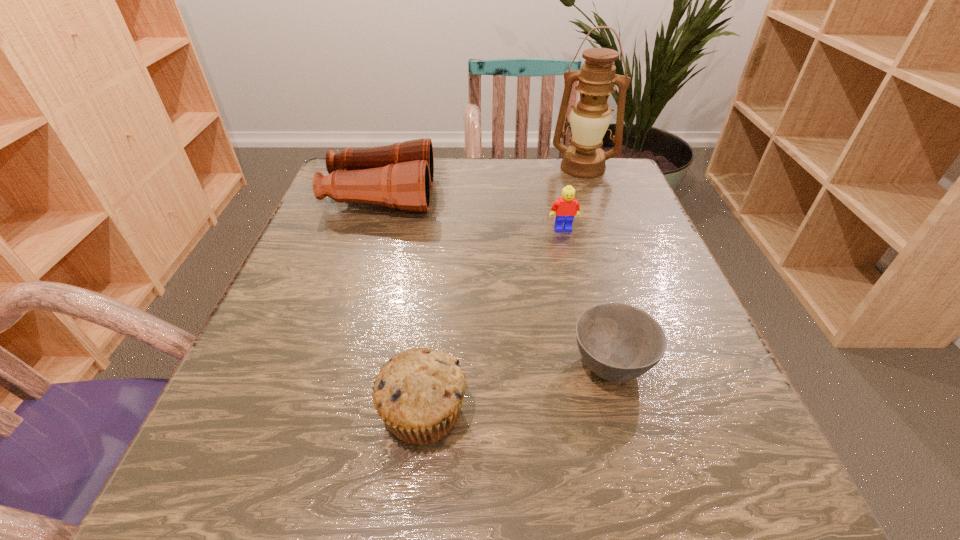
Identify the location of oil lamp located at the far edge. (589, 119).

Where is `binoculars located at the far edge`? The image size is (960, 540). binoculars located at the far edge is located at coordinates (400, 175).

Where is `object at the near edge`? object at the near edge is located at coordinates (418, 394).

Find the location of a particular element. The width and height of the screenshot is (960, 540). object situated at the left edge is located at coordinates (400, 175).

Find the location of `oil lamp at the right edge`. oil lamp at the right edge is located at coordinates (589, 119).

Image resolution: width=960 pixels, height=540 pixels. I want to click on Lego located at the right edge, so click(567, 207).

You are a GUI agent. You are given a task and a screenshot of the screen. Output one action in this format:
    pyautogui.click(x=<x>, y=<y>)
    Task: Click on the bowl that is at the right edge
    This screenshot has height=540, width=960.
    Given the screenshot: What is the action you would take?
    pyautogui.click(x=618, y=342)

The width and height of the screenshot is (960, 540). What are the coordinates of `object located at the far left corner` in the screenshot? It's located at (400, 175).

The height and width of the screenshot is (540, 960). I want to click on object positioned at the far right corner, so click(x=589, y=119).

Identify the location of vacant position at the far edge of the desktop. The width and height of the screenshot is (960, 540). (531, 161).